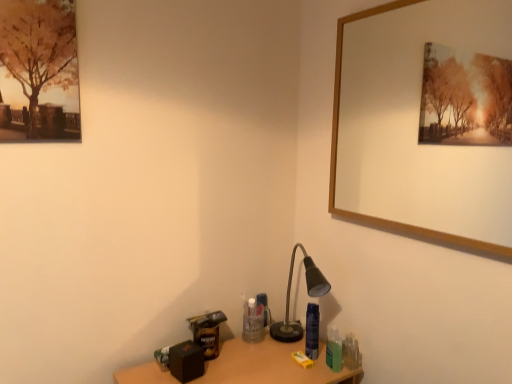
Where is `vacant region to the left of matte black desk lamp at lower right`? vacant region to the left of matte black desk lamp at lower right is located at coordinates (243, 353).